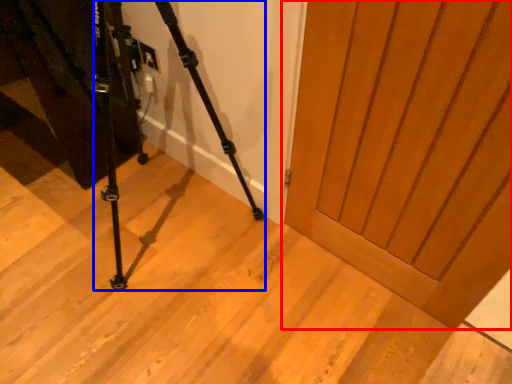
Question: Which object is further to the camera taking this photo, door (highlighted by a red box) or tripod (highlighted by a blue box)?

Choices:
 (A) door
 (B) tripod

Answer: (A)